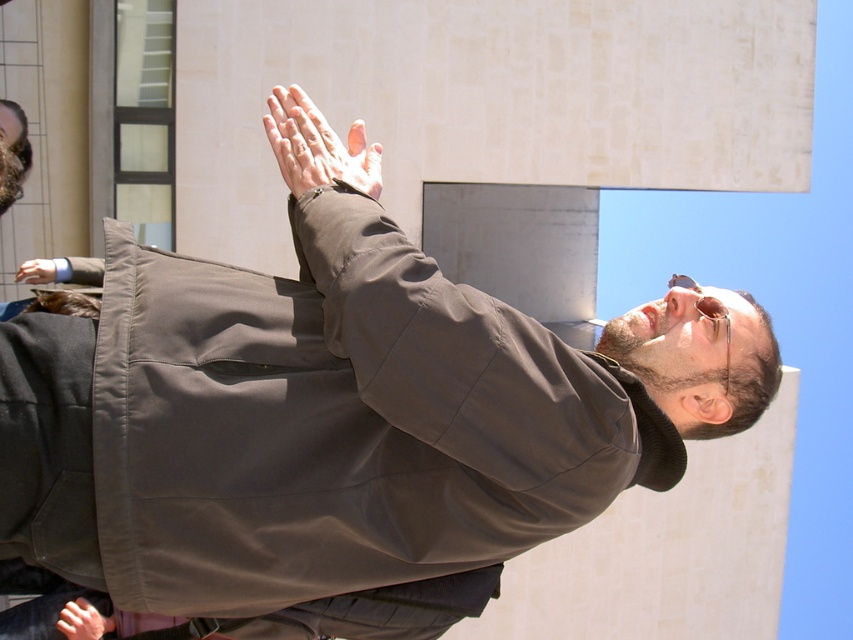
Consider the image. Is smooth skin hand at center bigger than matte black hand at lower left?

Yes, smooth skin hand at center is bigger than matte black hand at lower left.

Does smooth skin hand at center have a lesser height compared to matte black hand at lower left?

No, smooth skin hand at center is not shorter than matte black hand at lower left.

This screenshot has width=853, height=640. I want to click on smooth skin hand at center, so (x=318, y=147).

Does smooth skin hand at lower left have a larger size compared to sunglasses at upper center?

Incorrect, smooth skin hand at lower left is not larger than sunglasses at upper center.

Which of these two, smooth skin hand at lower left or sunglasses at upper center, stands shorter?

Standing shorter between the two is smooth skin hand at lower left.

Find the location of a particular element. The width and height of the screenshot is (853, 640). smooth skin hand at lower left is located at coordinates (83, 620).

Who is positioned more to the left, smooth skin hand at lower left or matte black hand at lower left?

Positioned to the left is matte black hand at lower left.

Is point (80, 611) positioned after point (28, 276)?

No.

At what (x,y) coordinates should I click in order to perform the action: click on smooth skin hand at lower left. Please return your answer as a coordinate pair (x, y). The height and width of the screenshot is (640, 853). Looking at the image, I should click on [83, 620].

This screenshot has height=640, width=853. I want to click on smooth skin hand at lower left, so click(83, 620).